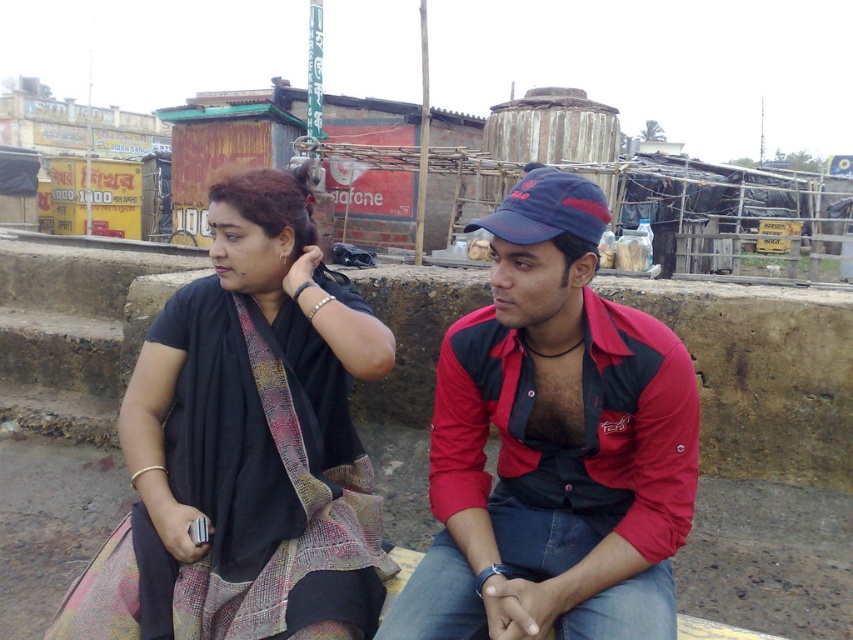
From the picture: You are a photographer trying to capture a portrait of both the red fabric shirt at center and the black woven sari at left. Based on their positions, which one is located to the right of the other?

The red fabric shirt at center is positioned on the right side of black woven sari at left.

What is located at the coordinates point (554,444)?

The red fabric shirt at center is located at point (554,444).